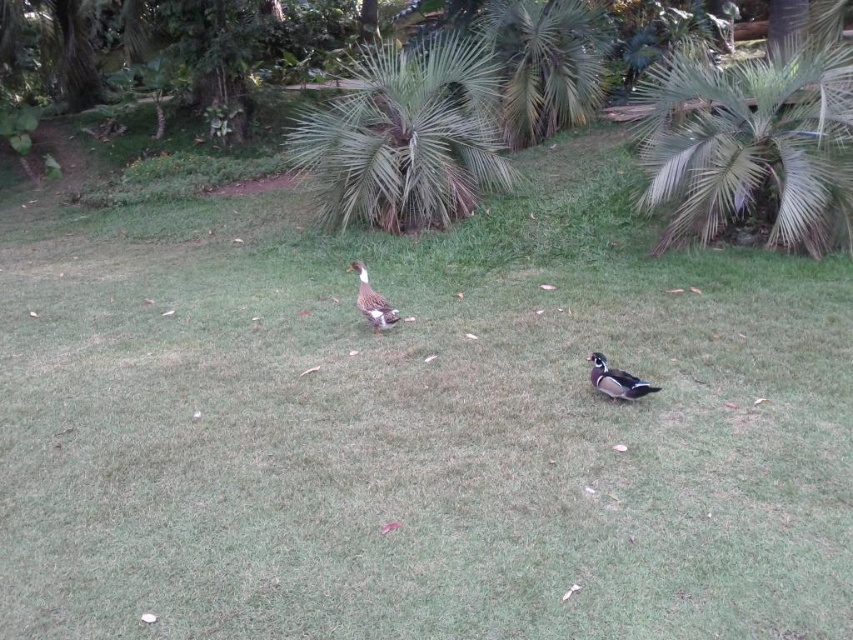
Does green leafy palm tree at center appear under green glossy duck at center?

Incorrect, green leafy palm tree at center is not positioned below green glossy duck at center.

Find the location of `green leafy palm tree at center`. green leafy palm tree at center is located at coordinates (404, 138).

Describe the element at coordinates (404, 138) in the screenshot. Image resolution: width=853 pixels, height=640 pixels. I see `green leafy palm tree at center` at that location.

Where is `green leafy palm tree at center`? green leafy palm tree at center is located at coordinates (404, 138).

Is point (521, 45) closer to viewer compared to point (598, 385)?

No, (521, 45) is behind (598, 385).

Does green leafy palm tree at upper center have a lesser width compared to shiny brown duck at lower right?

No.

Where is `green leafy palm tree at upper center`? green leafy palm tree at upper center is located at coordinates (546, 64).

Who is shorter, green leafy palm tree at center or shiny brown duck at lower right?

shiny brown duck at lower right

In the scene shown: Which of these two, green leafy palm tree at center or shiny brown duck at lower right, stands taller?

green leafy palm tree at center

Where is `green leafy palm tree at center`? green leafy palm tree at center is located at coordinates (404, 138).

At what (x,y) coordinates should I click in order to perform the action: click on green leafy palm tree at center. Please return your answer as a coordinate pair (x, y). This screenshot has width=853, height=640. Looking at the image, I should click on (404, 138).